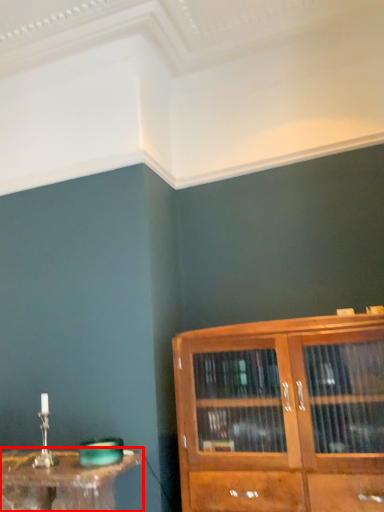
Question: From the image's perspective, what is the correct spatial relationship of table (annotated by the red box) in relation to cupboard?

Choices:
 (A) above
 (B) below

Answer: (B)